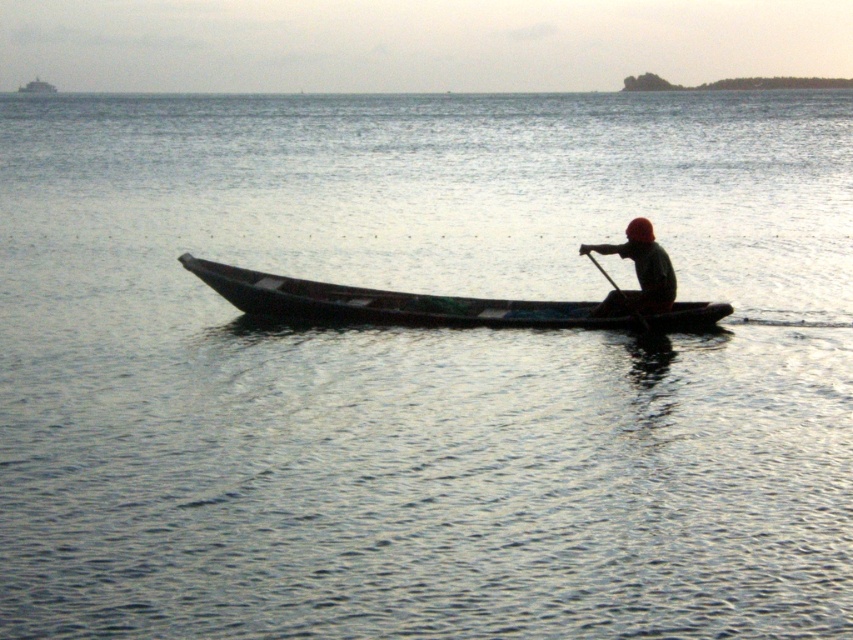
You are planning to store the dark wood canoe at center and the wooden at center in a storage room that is 2 meters wide. Based on their widths, can both objects fit side by side within the storage room?

The dark wood canoe at center is wider than the wooden at center. However, without knowing their exact widths, it is impossible to determine if their combined width is less than or equal to 2 meters. More information is needed to answer this question.

You are planning to place a decorative item on the dark green fabric at center and the wooden at center. Which surface can accommodate a wider object?

The dark green fabric at center might be wider than wooden at center, so it can accommodate a wider object.

You are planning to store the dark wood canoe at center and the dark green fabric at center in a storage room that has a width of 1.2 meters. Based on their sizes, will both items fit side by side within the storage room?

The dark wood canoe at center is wider than the dark green fabric at center. However, without knowing their exact widths or the total required space, we cannot definitively determine if they will fit side by side in the 1.2 meters width storage room.